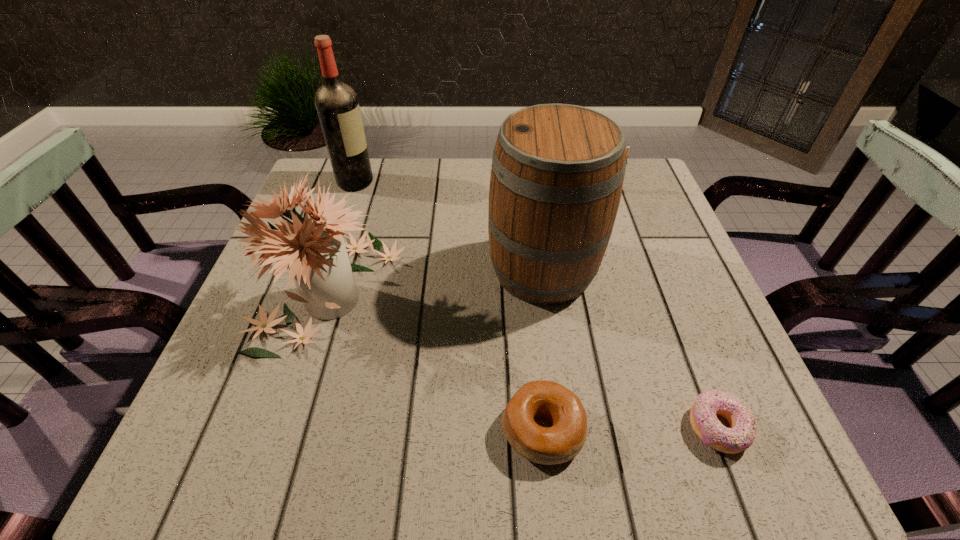
Image resolution: width=960 pixels, height=540 pixels. Find the location of `vacant region located 0.090m on the right of the fifth tallest object`. vacant region located 0.090m on the right of the fifth tallest object is located at coordinates (639, 430).

Image resolution: width=960 pixels, height=540 pixels. I want to click on vacant space situated on the back of the shortest object, so click(682, 337).

In order to click on liquor that is at the far edge in this screenshot , I will do `click(337, 105)`.

This screenshot has width=960, height=540. I want to click on candle positioned at the far edge, so click(627, 148).

Locate an element on the screen. The width and height of the screenshot is (960, 540). bagel at the near edge is located at coordinates (560, 443).

Locate an element on the screen. This screenshot has width=960, height=540. doughnut present at the near edge is located at coordinates (742, 432).

This screenshot has width=960, height=540. I want to click on liquor that is at the left edge, so click(337, 105).

Image resolution: width=960 pixels, height=540 pixels. I want to click on bouquet that is at the left edge, so click(315, 253).

Where is `candle that is at the right edge`? The height and width of the screenshot is (540, 960). candle that is at the right edge is located at coordinates (627, 148).

Where is `doughnut positioned at the right edge`? The width and height of the screenshot is (960, 540). doughnut positioned at the right edge is located at coordinates (742, 432).